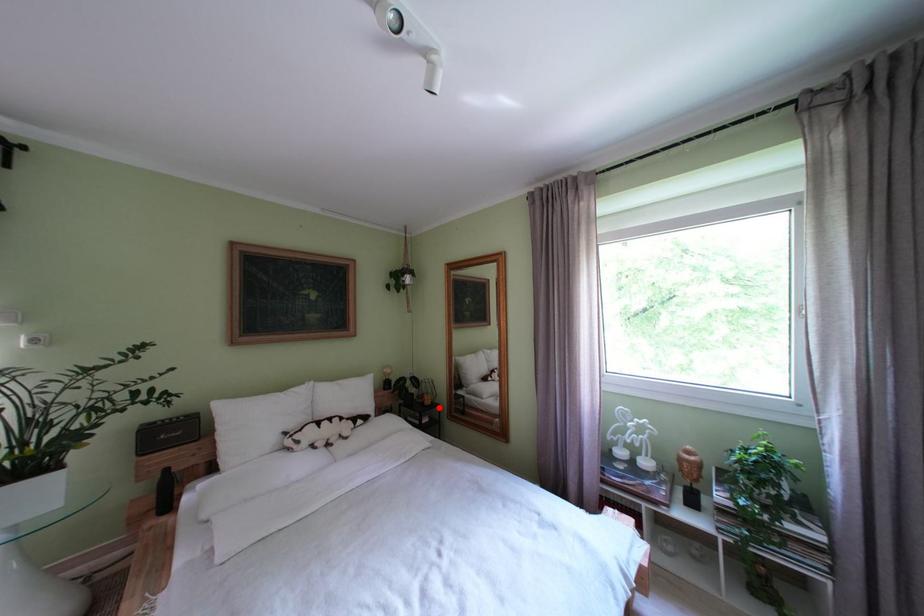
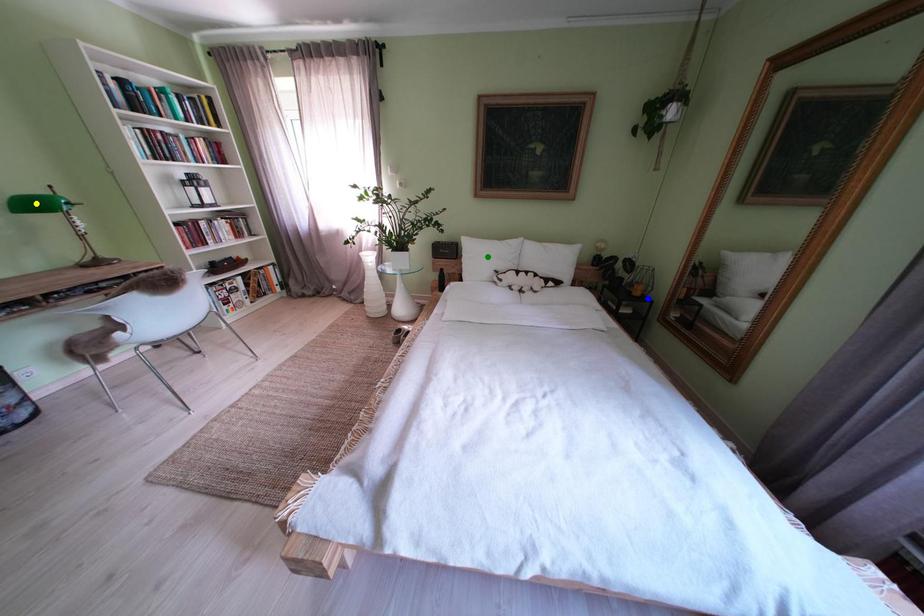
Question: I am providing you with two images of the same scene from different viewpoints. A red point is marked on the first image. You are given multiple points on the second image. Which point in image 2 represents the same 3d spot as the red point in image 1?

Choices:
 (A) yellow point
 (B) blue point
 (C) green point

Answer: (B)